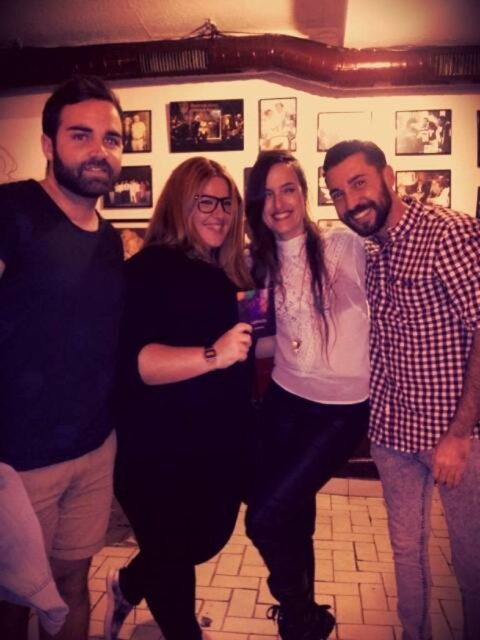
You are at a party and want to take a photo of the red checkered shirt at right and the wooden photo frame at upper center. Which one is taller?

The red checkered shirt at right is taller than the wooden photo frame at upper center.